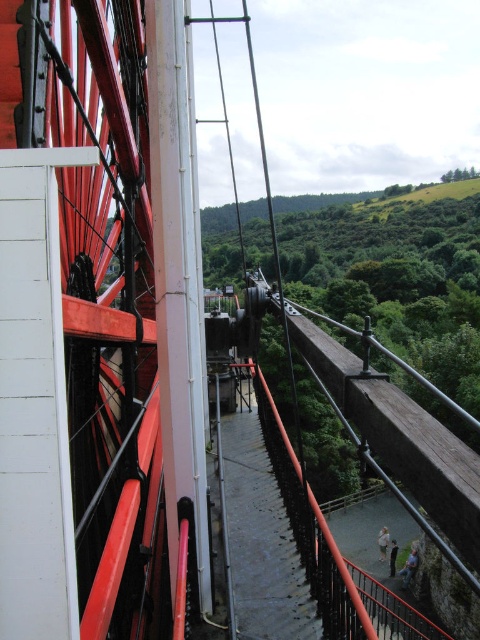
You are a maintenance worker in the industrial area. You see a light brown leather jacket at center and a dark gray fabric at lower center. Which object is bigger in size?

The light brown leather jacket at center has a larger size compared to the dark gray fabric at lower center.

You are standing on the walkway near the massive red and white metal framework of the industrial structure. You notice two points marked as point (381, 536) and point (397, 547). Which point is closer to you?

Point (381, 536) is further to the viewer than point (397, 547), so the closer point to you is point (397, 547).